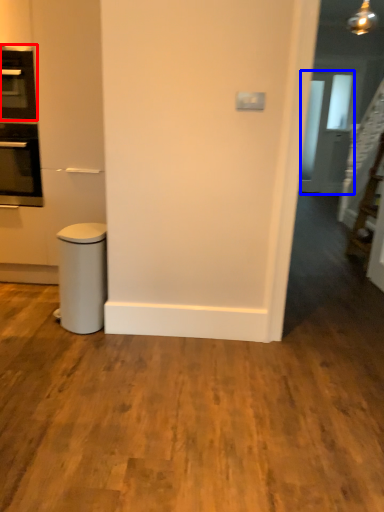
Question: Among these objects, which one is farthest to the camera, home appliance (highlighted by a red box) or glass door (highlighted by a blue box)?

Choices:
 (A) home appliance
 (B) glass door

Answer: (B)